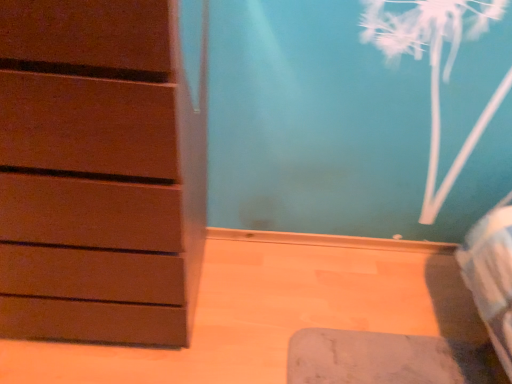
Measure the distance between point (1,159) and camera.

Point (1,159) and camera are 32.05 inches apart from each other.

This screenshot has height=384, width=512. I want to click on matte brown chest of drawers at left, so 100,172.

This screenshot has height=384, width=512. What do you see at coordinates (100, 172) in the screenshot?
I see `matte brown chest of drawers at left` at bounding box center [100, 172].

Identify the location of matte brown chest of drawers at left. This screenshot has width=512, height=384. tap(100, 172).